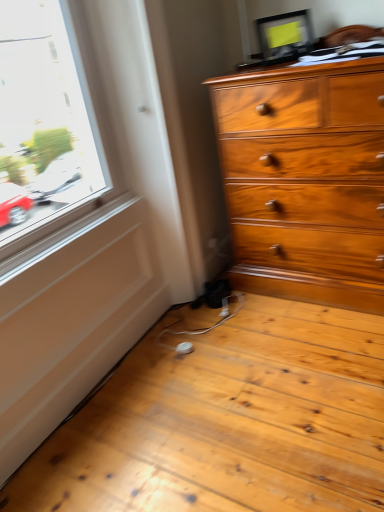
The width and height of the screenshot is (384, 512). What do you see at coordinates (284, 36) in the screenshot? I see `matte black monitor at upper center` at bounding box center [284, 36].

Locate an element on the screen. The height and width of the screenshot is (512, 384). matte black monitor at upper center is located at coordinates (284, 36).

Measure the distance between matte black monitor at upper center and camera.

They are 5.62 feet apart.

Locate an element on the screen. The height and width of the screenshot is (512, 384). matte black monitor at upper center is located at coordinates (284, 36).